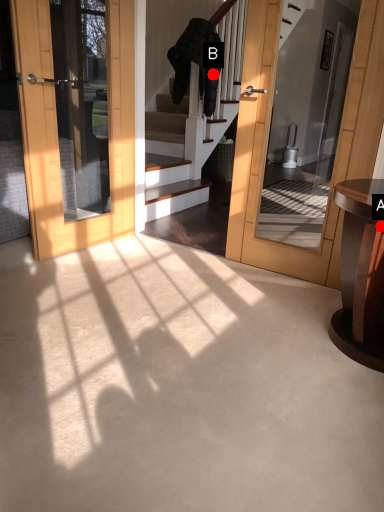
Question: Two points are circled on the image, labeled by A and B beside each circle. Which point is closer to the camera?

Choices:
 (A) A is closer
 (B) B is closer

Answer: (A)